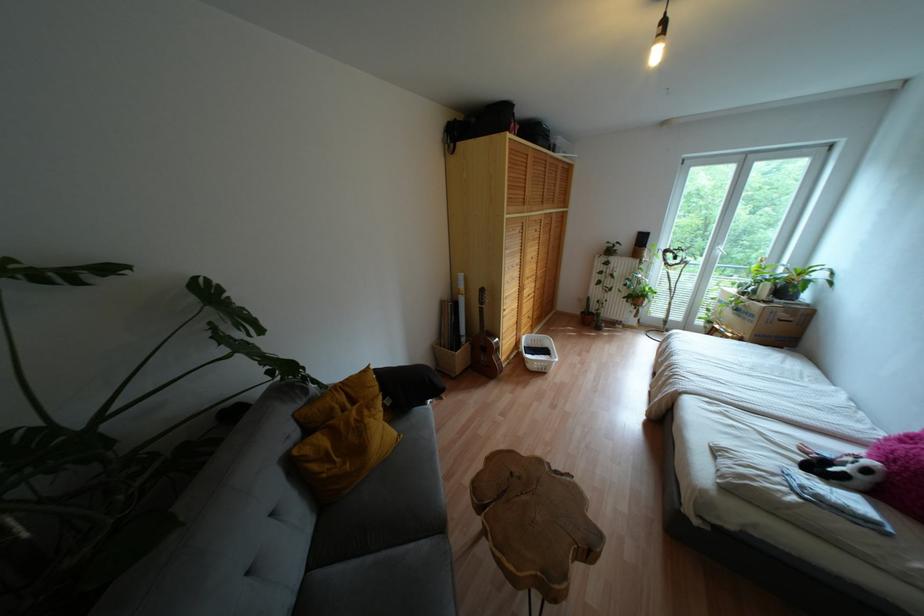
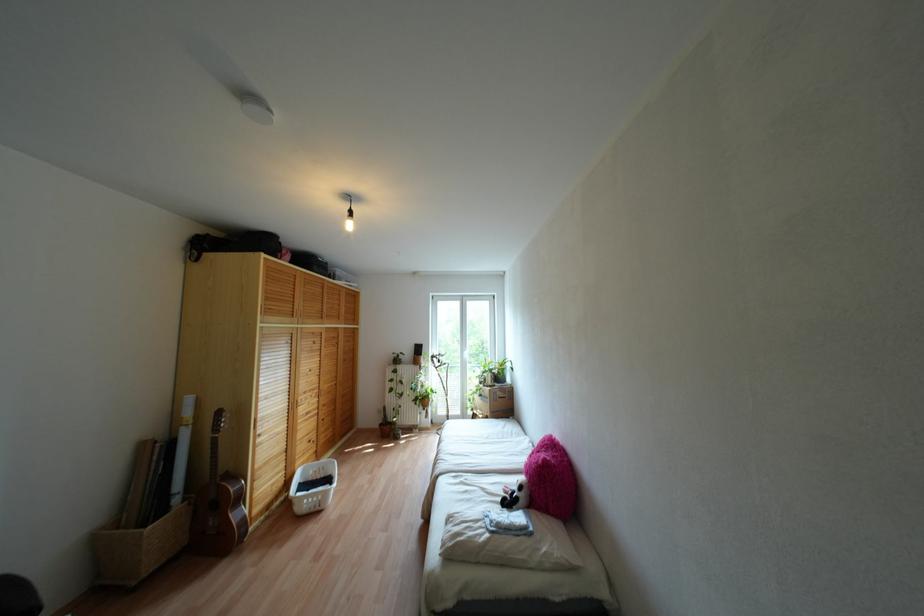
The point at (657, 53) is marked in the first image. Where is the corresponding point in the second image?

(348, 225)